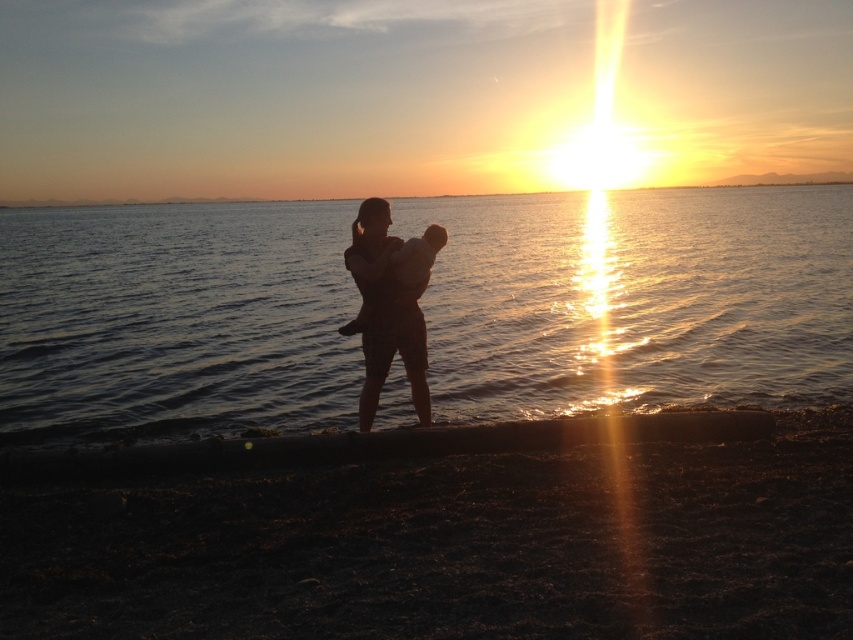
I want to click on glistening water at center, so click(x=637, y=300).

Find the location of a particular element. The height and width of the screenshot is (640, 853). glistening water at center is located at coordinates (637, 300).

Who is higher up, dark sand at lower center or silhouette fabric at center?

silhouette fabric at center is higher up.

Does point (712, 465) lie behind point (401, 332)?

No, it is not.

Between point (512, 592) and point (384, 266), which one is positioned in front?

Point (512, 592) is in front.

Locate an element on the screen. Image resolution: width=853 pixels, height=640 pixels. dark sand at lower center is located at coordinates (451, 547).

Who is more distant from viewer, (45,218) or (57,612)?

Positioned behind is point (45,218).

Can you confirm if glistening water at center is positioned above dark sand at lower center?

Yes, glistening water at center is above dark sand at lower center.

The image size is (853, 640). What do you see at coordinates (637, 300) in the screenshot? I see `glistening water at center` at bounding box center [637, 300].

Where is `glistening water at center`? Image resolution: width=853 pixels, height=640 pixels. glistening water at center is located at coordinates (637, 300).